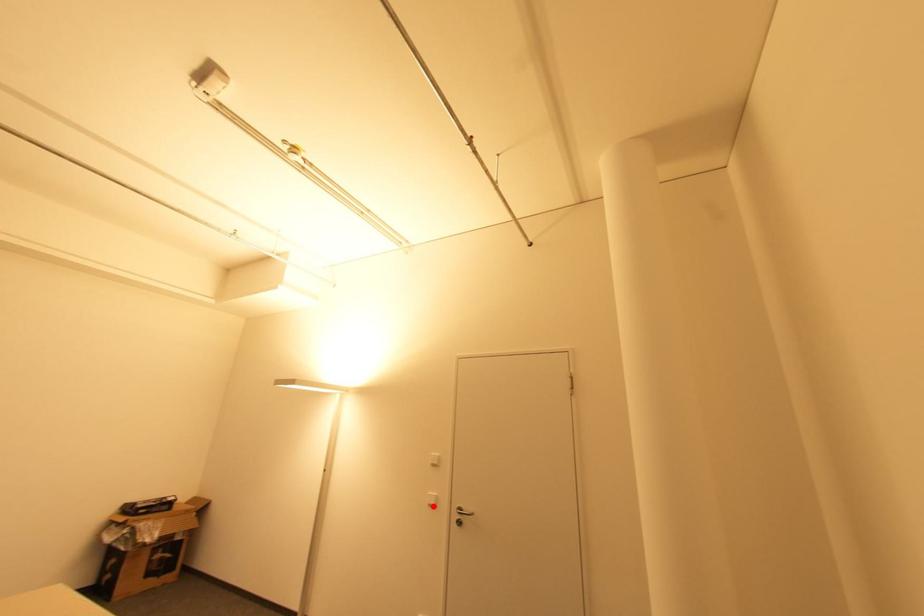
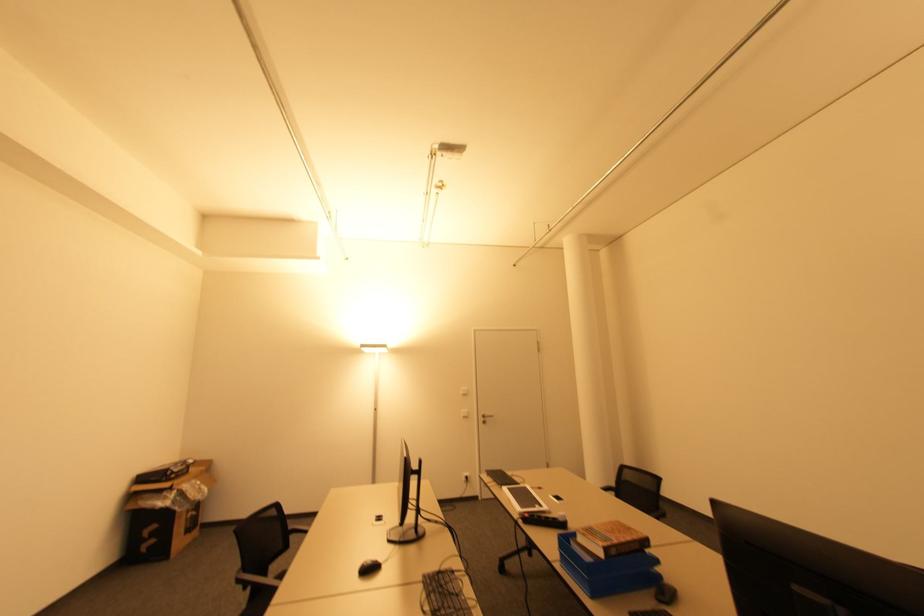
Where in the second image is the point corresponding to the highlighted location from the first image?

(467, 416)